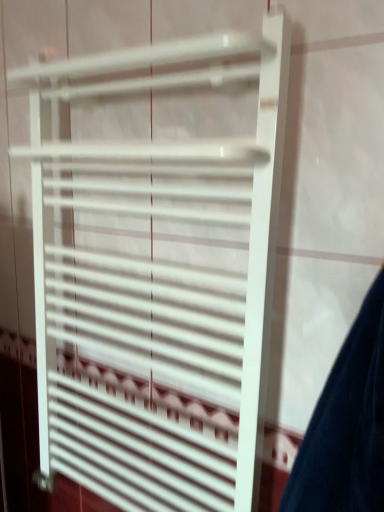
Identify the location of white matte radiator at center. The width and height of the screenshot is (384, 512). (155, 278).

Measure the distance between white matte radiator at center and camera.

white matte radiator at center and camera are 22.30 inches apart from each other.

What do you see at coordinates (155, 278) in the screenshot? The width and height of the screenshot is (384, 512). I see `white matte radiator at center` at bounding box center [155, 278].

Identify the location of white matte radiator at center. This screenshot has width=384, height=512. (155, 278).